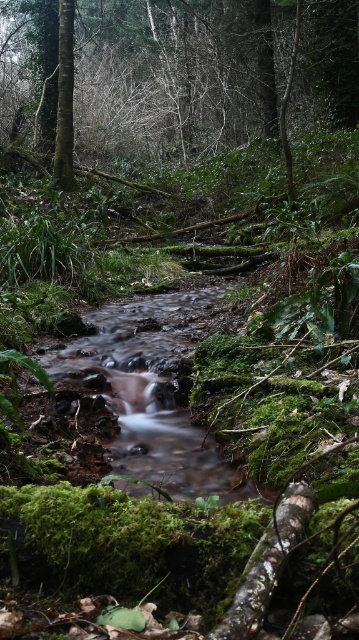
You are a hiker trying to cross the stream in the forest. You see a green mossy tree at center and clear water at center. Which object should you avoid stepping on to stay dry?

You should avoid stepping on the green mossy tree at center because it is positioned over the clear water at center, so stepping on the tree would keep you dry while the water is below.

You are a hiker trying to navigate through the forest. You see the green mossy tree at center. Can you estimate its position in the image using a coordinate system where the bottom left corner is the origin?

The green mossy tree at center is located at coordinates approximately 0.119 on the x axis and 0.577 on the y axis.

You are a hiker trying to cross the stream in the forest. You see the green mossy tree at center and the clear water at center. Which object is larger and might provide a better anchor point for a makeshift bridge?

The green mossy tree at center is bigger than the clear water at center, so it would provide a better anchor point for a makeshift bridge.